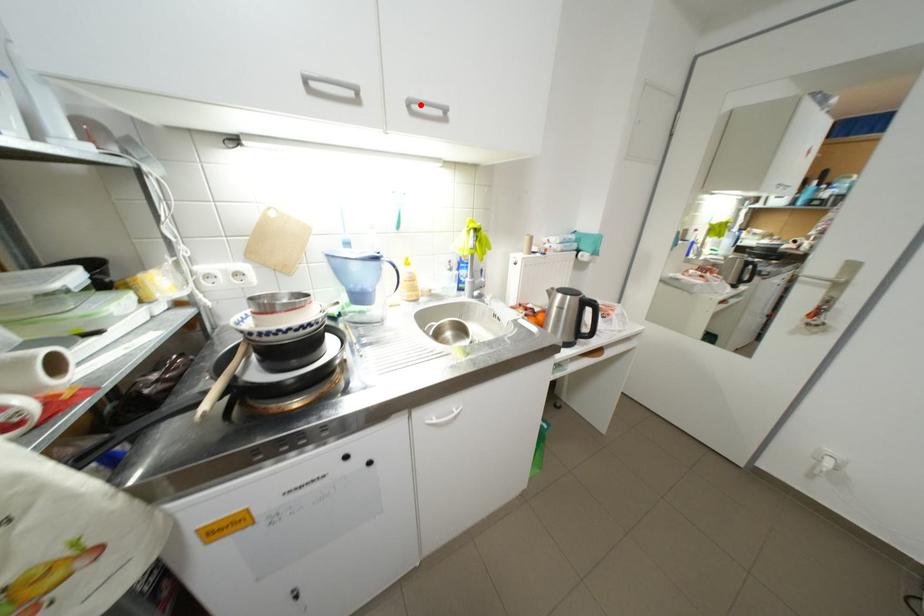
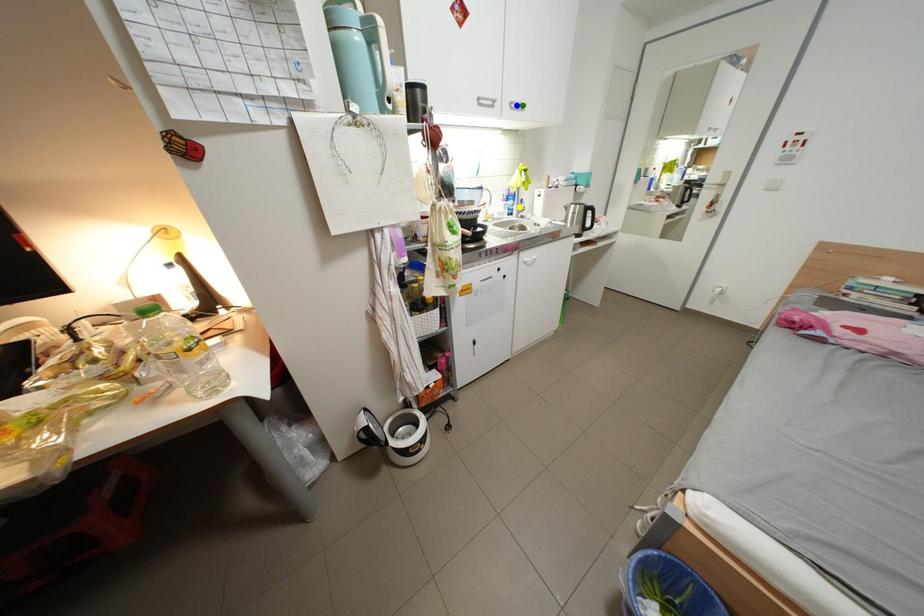
Question: I am providing you with two images of the same scene from different viewpoints. A red point is marked on the first image. You are given multiple points on the second image. Which mark in image 2 goes with the point in image 1?

Choices:
 (A) green point
 (B) yellow point
 (C) blue point

Answer: (A)